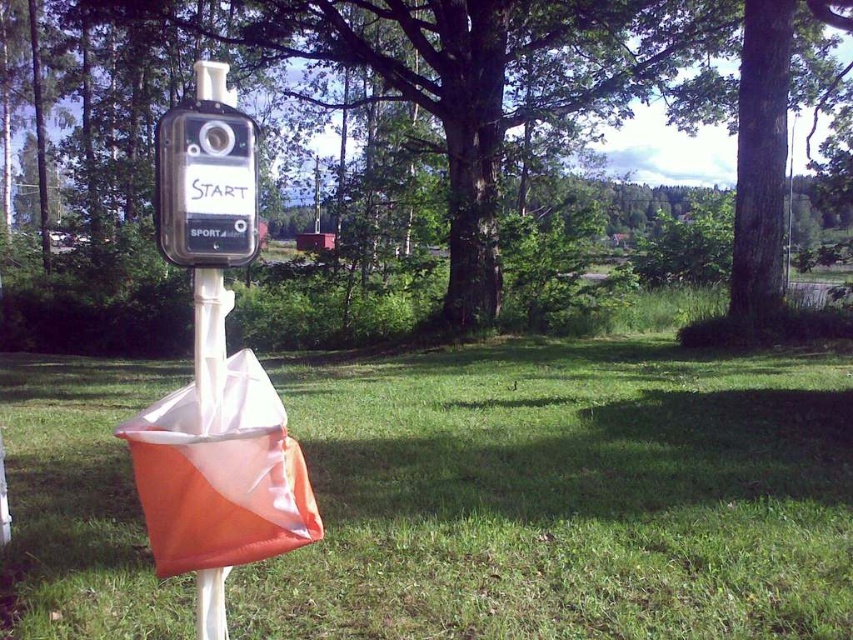
Which is more to the left, green grass at center or green leafy tree at center?

green grass at center is more to the left.

Which is below, green grass at center or green leafy tree at center?

green grass at center is lower down.

Find the location of `green grass at center`. green grass at center is located at coordinates (566, 497).